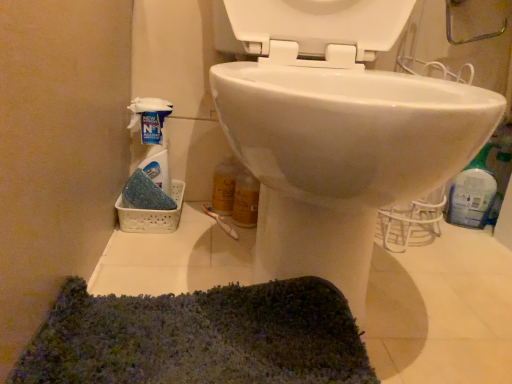
Question: From a real-world perspective, is white plastic spray bottle at left, the first cleaning product positioned from the left, below white glossy toilet at center?

Choices:
 (A) yes
 (B) no

Answer: (A)

Question: Considering the relative positions of white plastic spray bottle at left, the first cleaning product positioned from the left, and white glossy toilet at center in the image provided, is white plastic spray bottle at left, the first cleaning product positioned from the left, to the right of white glossy toilet at center from the viewer's perspective?

Choices:
 (A) yes
 (B) no

Answer: (B)

Question: From the image's perspective, is white plastic spray bottle at left, which is the second cleaning product in right-to-left order, above white glossy toilet at center?

Choices:
 (A) yes
 (B) no

Answer: (B)

Question: Is white plastic spray bottle at left, which is the second cleaning product in right-to-left order, oriented away from white glossy toilet at center?

Choices:
 (A) no
 (B) yes

Answer: (A)

Question: Can you confirm if white plastic spray bottle at left, the first cleaning product positioned from the left, is shorter than white glossy toilet at center?

Choices:
 (A) yes
 (B) no

Answer: (A)

Question: Is white plastic spray bottle at left, the first cleaning product positioned from the left, situated inside blue plastic bottle at right, which is counted as the 1th cleaning product, starting from the right, or outside?

Choices:
 (A) inside
 (B) outside

Answer: (B)

Question: From their relative heights in the image, would you say white plastic spray bottle at left, the first cleaning product positioned from the left, is taller or shorter than blue plastic bottle at right, which is counted as the 1th cleaning product, starting from the right?

Choices:
 (A) tall
 (B) short

Answer: (B)

Question: From a real-world perspective, is white plastic spray bottle at left, which is the second cleaning product in right-to-left order, above or below blue plastic bottle at right, which is counted as the 1th cleaning product, starting from the right?

Choices:
 (A) below
 (B) above

Answer: (A)

Question: In terms of size, does white plastic spray bottle at left, which is the second cleaning product in right-to-left order, appear bigger or smaller than blue plastic bottle at right, which appears as the second cleaning product when viewed from the left?

Choices:
 (A) big
 (B) small

Answer: (B)

Question: From the image's perspective, is white plastic spray bottle at left, which is the second cleaning product in right-to-left order, positioned above or below white glossy toilet at center?

Choices:
 (A) above
 (B) below

Answer: (B)

Question: From a real-world perspective, is white plastic spray bottle at left, which is the second cleaning product in right-to-left order, positioned above or below white glossy toilet at center?

Choices:
 (A) below
 (B) above

Answer: (A)

Question: Is point (139, 125) closer or farther from the camera than point (286, 160)?

Choices:
 (A) closer
 (B) farther

Answer: (B)

Question: Considering the positions of white plastic spray bottle at left, the first cleaning product positioned from the left, and white glossy toilet at center in the image, is white plastic spray bottle at left, the first cleaning product positioned from the left, taller or shorter than white glossy toilet at center?

Choices:
 (A) short
 (B) tall

Answer: (A)

Question: In terms of size, does white glossy toilet at center appear bigger or smaller than white plastic spray bottle at left, which is the second cleaning product in right-to-left order?

Choices:
 (A) small
 (B) big

Answer: (B)

Question: Is point (274, 18) positioned closer to the camera than point (165, 162)?

Choices:
 (A) farther
 (B) closer

Answer: (B)